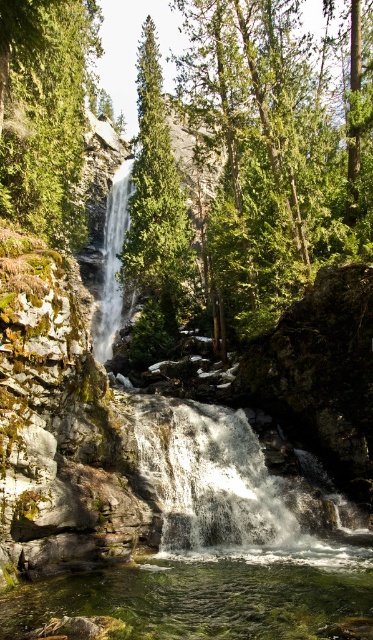
Question: Does clear water at center appear on the right side of green matte tree at upper left?

Choices:
 (A) no
 (B) yes

Answer: (B)

Question: Which point appears farthest from the camera in this image?

Choices:
 (A) (123, 208)
 (B) (195, 442)
 (C) (74, 228)

Answer: (A)

Question: From the image, what is the correct spatial relationship of clear water at center in relation to white frothy water at center?

Choices:
 (A) below
 (B) above

Answer: (A)

Question: In this image, where is clear water at center located relative to green matte tree at center?

Choices:
 (A) left
 (B) right

Answer: (B)

Question: Which of the following is the closest to the observer?

Choices:
 (A) white textured waterfall at center
 (B) green matte tree at upper left
 (C) white frothy water at center
 (D) clear water at center

Answer: (D)

Question: Based on their relative distances, which object is farther from the white frothy water at center?

Choices:
 (A) clear water at center
 (B) green matte tree at upper left

Answer: (B)